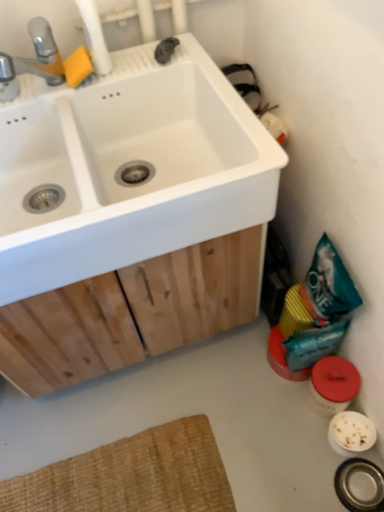
Question: Is point (46, 65) closer or farther from the camera than point (322, 330)?

Choices:
 (A) farther
 (B) closer

Answer: (B)

Question: From a real-world perspective, relative to teal matte bag at lower right, is brushed metal faucet at upper left vertically above or below?

Choices:
 (A) below
 (B) above

Answer: (B)

Question: Estimate the real-world distances between objects in this image. Which object is closer to the white matte sink at upper left?

Choices:
 (A) brushed metal faucet at upper left
 (B) teal matte bag at lower right

Answer: (A)

Question: Estimate the real-world distances between objects in this image. Which object is farther from the white matte sink at upper left?

Choices:
 (A) brushed metal faucet at upper left
 (B) teal matte bag at lower right

Answer: (B)